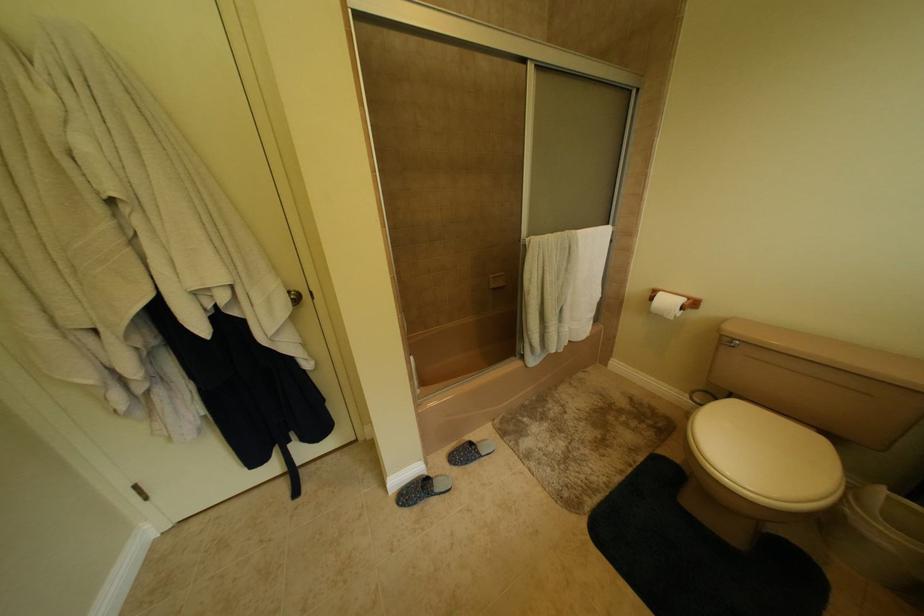
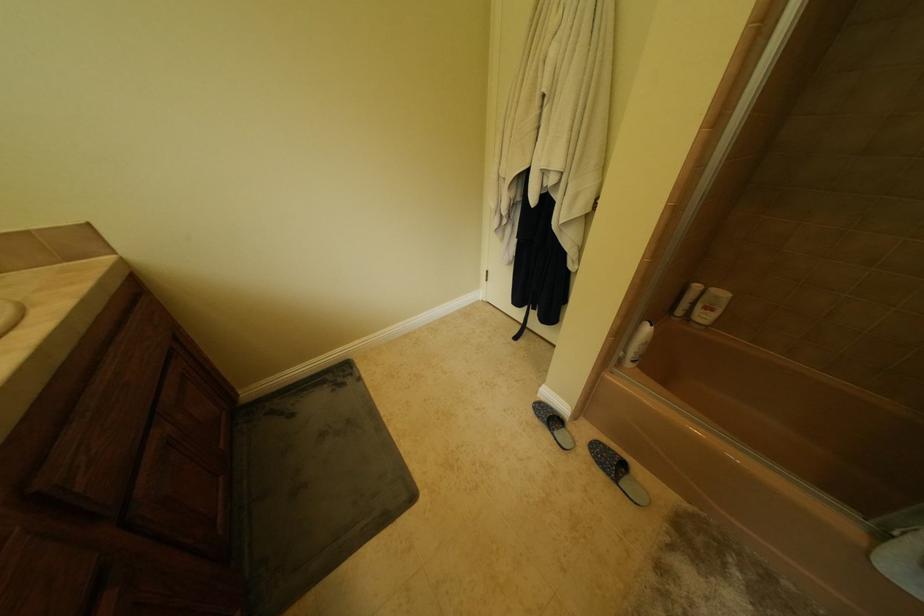
In the scene shown: The images are taken continuously from a first-person perspective. In which direction is your viewpoint rotating?

The rotation direction of the camera is left-down.